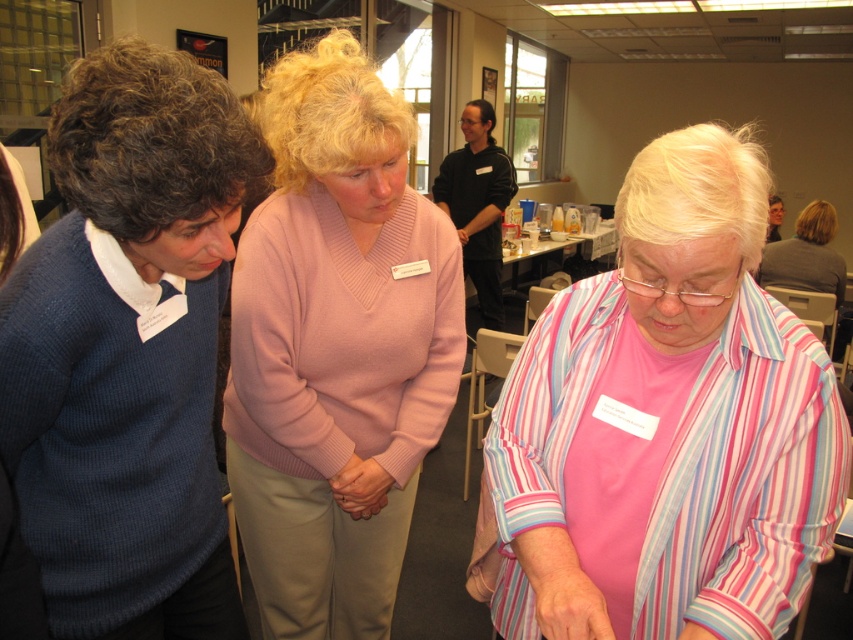
Question: Can you confirm if dark blue ribbed sweater at left is positioned above pink sweater at center?

Choices:
 (A) no
 (B) yes

Answer: (A)

Question: Is pink striped shirt at center below pink sweater at center?

Choices:
 (A) no
 (B) yes

Answer: (B)

Question: Is pink striped shirt at center to the left of dark blue ribbed sweater at left from the viewer's perspective?

Choices:
 (A) no
 (B) yes

Answer: (A)

Question: Which point is closer to the camera taking this photo?

Choices:
 (A) (509, 412)
 (B) (86, 621)
 (C) (231, 323)

Answer: (B)

Question: Which point appears closest to the camera in this image?

Choices:
 (A) (90, 627)
 (B) (747, 305)
 (C) (393, 392)

Answer: (B)

Question: Which object is farther from the camera taking this photo?

Choices:
 (A) pink sweater at center
 (B) dark blue ribbed sweater at left
 (C) pink striped shirt at center

Answer: (A)